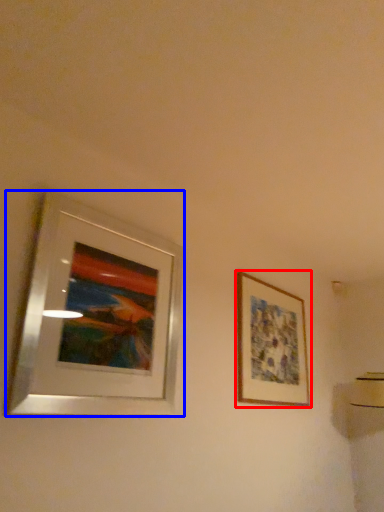
Question: Which point is closer to the camera, picture frame (highlighted by a red box) or picture frame (highlighted by a blue box)?

Choices:
 (A) picture frame
 (B) picture frame

Answer: (B)